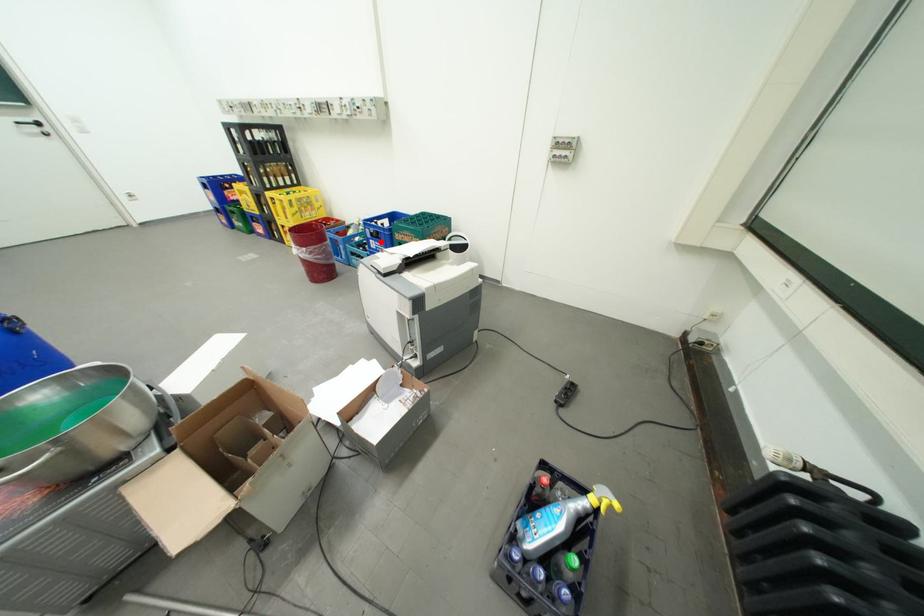
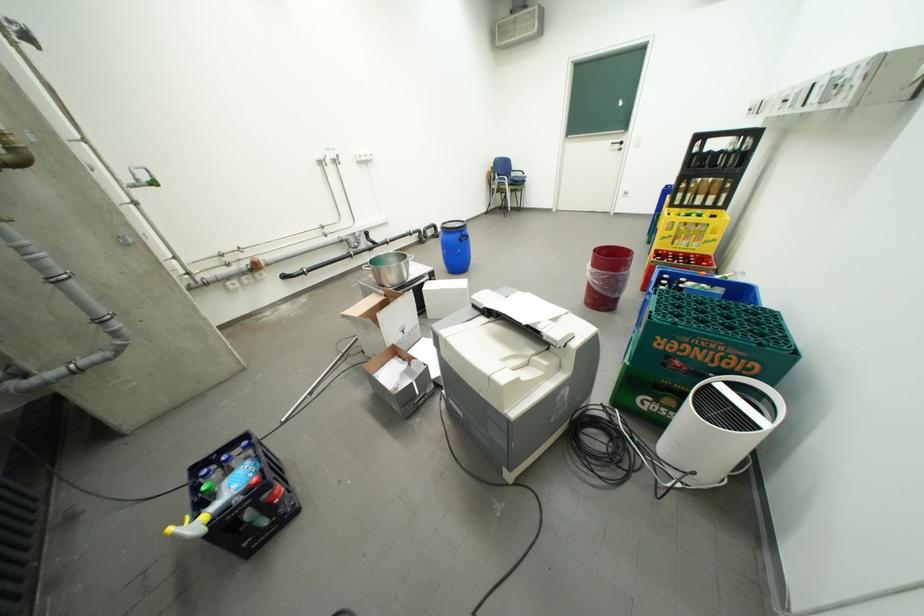
Question: I am providing you with two images of the same scene from different viewpoints. A red point is marked on the first image. At the location where the point appears in image 1, is it still visible in image 2?

Choices:
 (A) Yes
 (B) No

Answer: (B)